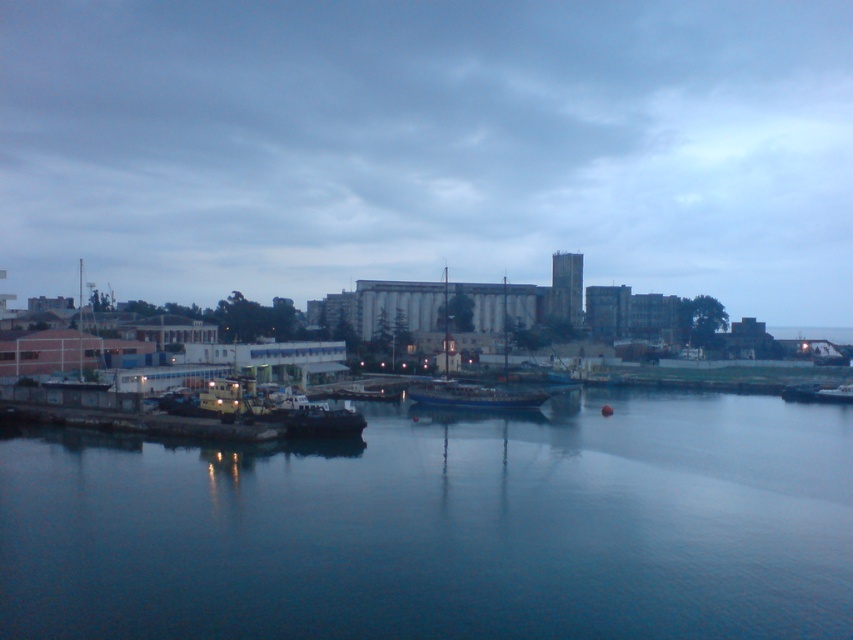
Can you confirm if blue smooth water at center is positioned above blue wooden boat at center?

No, blue smooth water at center is not above blue wooden boat at center.

Measure the distance between point (18, 636) and camera.

21.15 meters

Who is more distant from viewer, [663,417] or [444,308]?

The point [444,308] is behind.

I want to click on blue smooth water at center, so click(x=445, y=525).

Who is more forward, (438, 385) or (474, 390)?

Point (474, 390)

Locate an element on the screen. blue wooden boat at center is located at coordinates (473, 385).

The image size is (853, 640). What are the coordinates of `blue wooden boat at center` in the screenshot? It's located at (473, 385).

Does blue smooth water at center lie in front of blue metallic boat at center?

Yes, it is.

At what (x,y) coordinates should I click in order to perform the action: click on blue smooth water at center. Please return your answer as a coordinate pair (x, y). The height and width of the screenshot is (640, 853). Looking at the image, I should click on (445, 525).

This screenshot has height=640, width=853. Identify the location of blue smooth water at center. (445, 525).